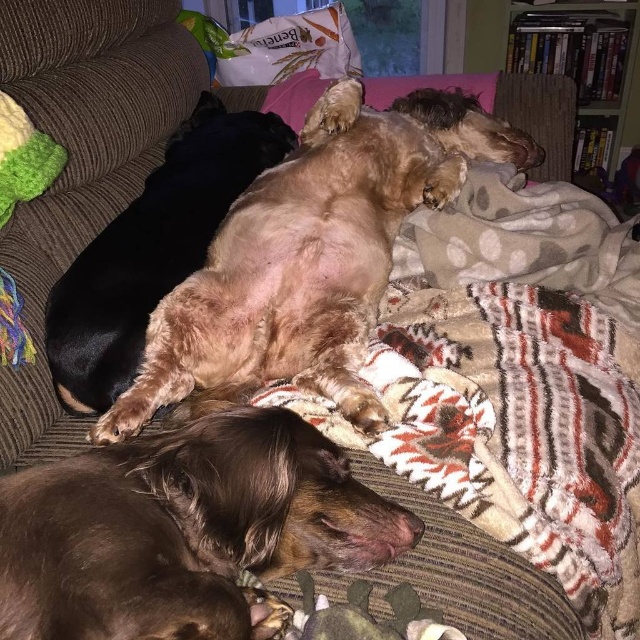
Between point (129, 298) and point (60, 156), which one is positioned behind?

The point (129, 298) is behind.

Between point (106, 241) and point (17, 176), which one is positioned in front?

Point (17, 176)

At what (x,y) coordinates should I click in order to perform the action: click on light brown fur at center. Please return your answer as a coordinate pair (x, y). Image resolution: width=640 pixels, height=640 pixels. Looking at the image, I should click on (150, 250).

Does brown fuzzy dog at lower left appear under fuzzy brown dog at center?

Yes.

The height and width of the screenshot is (640, 640). What do you see at coordinates (182, 529) in the screenshot?
I see `brown fuzzy dog at lower left` at bounding box center [182, 529].

Which is in front, point (378, 545) or point (317, 164)?

Positioned in front is point (378, 545).

Locate an element on the screen. brown fuzzy dog at lower left is located at coordinates (182, 529).

Is fuzzy brown dog at center taller than light brown fur at center?

Incorrect, fuzzy brown dog at center's height is not larger of light brown fur at center's.

Does fuzzy brown dog at center come behind light brown fur at center?

No, fuzzy brown dog at center is closer to the viewer.

Who is more distant from viewer, [417,164] or [99,268]?

Point [417,164]

This screenshot has width=640, height=640. In order to click on fuzzy brown dog at center in this screenshot , I will do `click(310, 256)`.